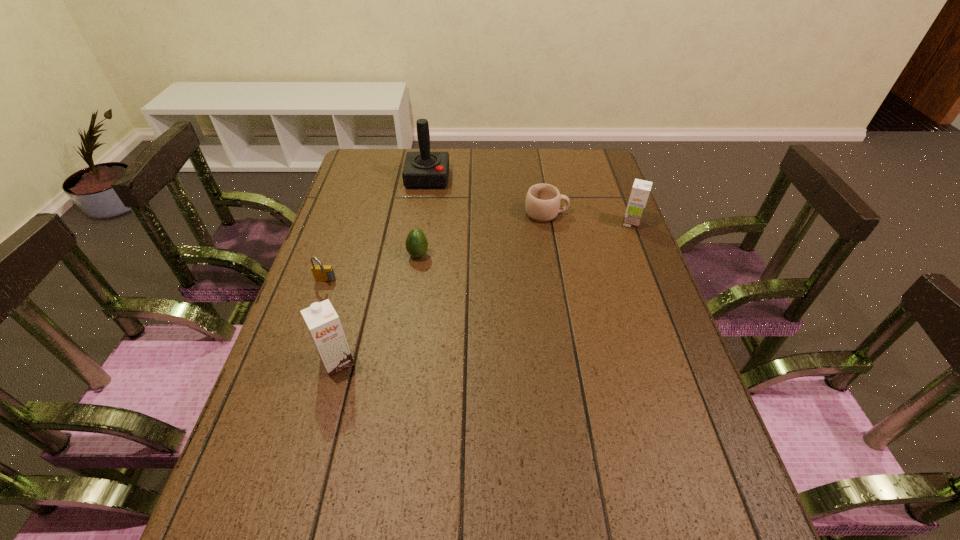
Locate an element on the screen. This screenshot has width=960, height=540. vacant space at the near edge is located at coordinates (466, 448).

The image size is (960, 540). Find the location of `free spot at the left edge of the desktop`. free spot at the left edge of the desktop is located at coordinates (350, 345).

Locate an element on the screen. This screenshot has height=540, width=960. vacant space at the right edge of the desktop is located at coordinates (576, 201).

In the image, there is a desktop. In order to click on free space at the far left corner in this screenshot , I will do 383,182.

Where is `vacant area at the far right corner of the desktop`? The height and width of the screenshot is (540, 960). vacant area at the far right corner of the desktop is located at coordinates (568, 166).

Identify the location of vacant point located between the third nearest object and the third tallest object. [x=525, y=239].

This screenshot has width=960, height=540. In order to click on free spot between the farthest object and the leftmost object in this screenshot , I will do `click(376, 230)`.

Where is `empty location between the fifth object from right to left and the third nearest object`? This screenshot has width=960, height=540. empty location between the fifth object from right to left and the third nearest object is located at coordinates (378, 309).

Where is `free space between the farther chocolate milk and the third nearest object`? The image size is (960, 540). free space between the farther chocolate milk and the third nearest object is located at coordinates (525, 239).

Where is `free spot between the joystick and the fourth farthest object`? free spot between the joystick and the fourth farthest object is located at coordinates (422, 217).